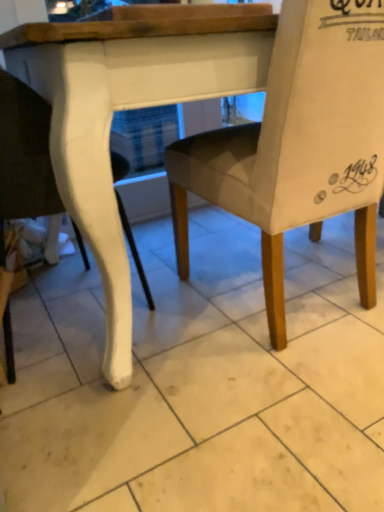
The width and height of the screenshot is (384, 512). What are the coordinates of `free space in front of white glossy chair leg at left, which ranks as the 1th chair in left-to-right order` in the screenshot? It's located at (105, 425).